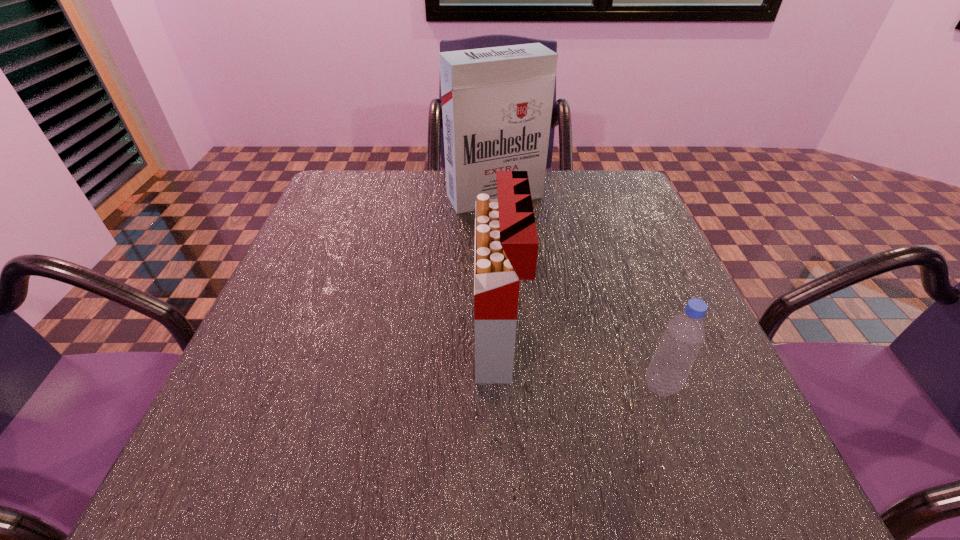
This screenshot has width=960, height=540. Identify the location of free location that satisfies the following two spatial constraints: 1. with the lid open on the second tallest object; 2. on the right side of the shortest object. pyautogui.click(x=499, y=386).

Where is `vacant region that satisfies the following two spatial constraints: 1. with the lid open on the bottle; 2. on the right side of the second shortest object`? vacant region that satisfies the following two spatial constraints: 1. with the lid open on the bottle; 2. on the right side of the second shortest object is located at coordinates (499, 386).

Where is `vacant space that satisfies the following two spatial constraints: 1. with the lid open on the shorter cigarette case; 2. on the right side of the bottle`? vacant space that satisfies the following two spatial constraints: 1. with the lid open on the shorter cigarette case; 2. on the right side of the bottle is located at coordinates (499, 386).

Identify the location of free region that satisfies the following two spatial constraints: 1. on the back side of the shortest object; 2. with the lid open on the second shortest object. (645, 341).

Where is `free point that satisfies the following two spatial constraints: 1. with the lid open on the bottle; 2. on the right side of the nearer cigarette case`? This screenshot has height=540, width=960. free point that satisfies the following two spatial constraints: 1. with the lid open on the bottle; 2. on the right side of the nearer cigarette case is located at coordinates (499, 386).

Where is `free space that satisfies the following two spatial constraints: 1. with the lid open on the shorter cigarette case; 2. on the left side of the shortest object`? This screenshot has width=960, height=540. free space that satisfies the following two spatial constraints: 1. with the lid open on the shorter cigarette case; 2. on the left side of the shortest object is located at coordinates (499, 386).